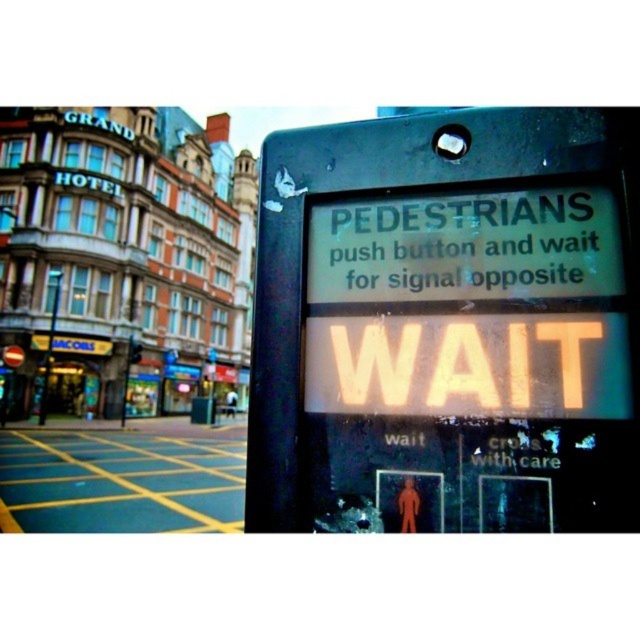
Which is in front, point (476, 413) or point (52, 312)?

Point (476, 413) is more forward.

Looking at this image, is black plastic pedestrian signal at center right wider than black plastic pole at left?

In fact, black plastic pedestrian signal at center right might be narrower than black plastic pole at left.

Between point (320, 328) and point (52, 323), which one is positioned behind?

The point (52, 323) is behind.

Locate an element on the screen. This screenshot has height=640, width=640. black plastic pedestrian signal at center right is located at coordinates (448, 324).